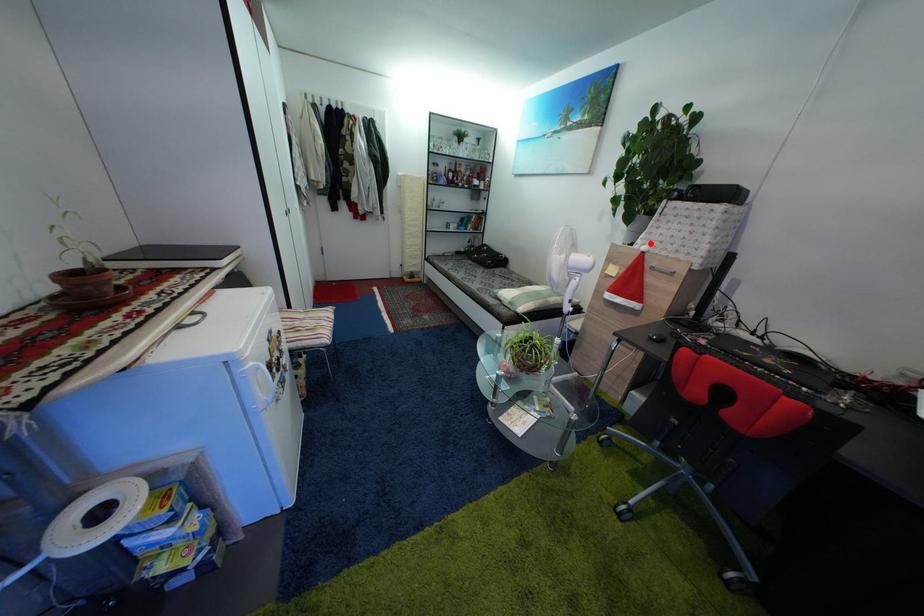
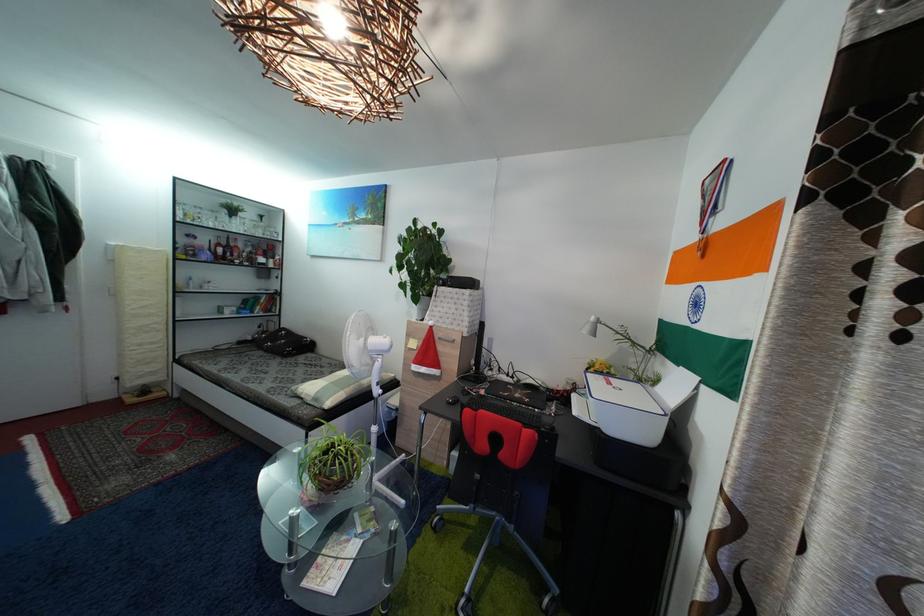
In the second image, find the point that corresponds to the highlighted location in the first image.

(435, 321)